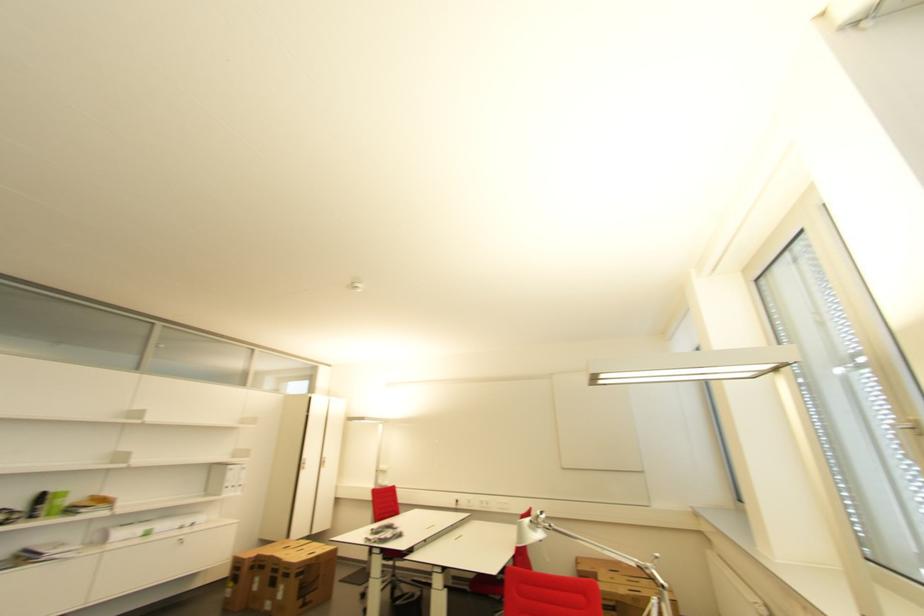
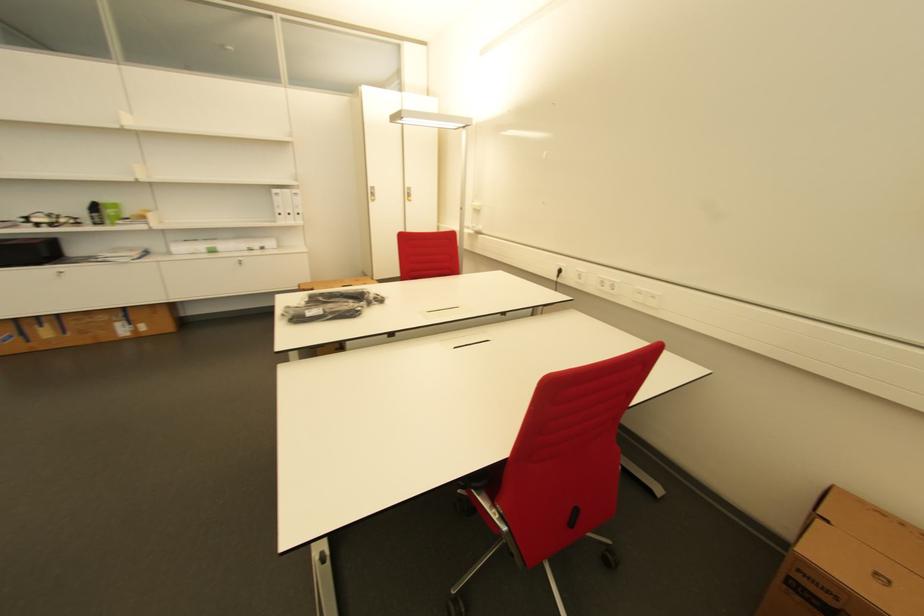
The point at (55, 498) is marked in the first image. Where is the corresponding point in the second image?

(104, 208)